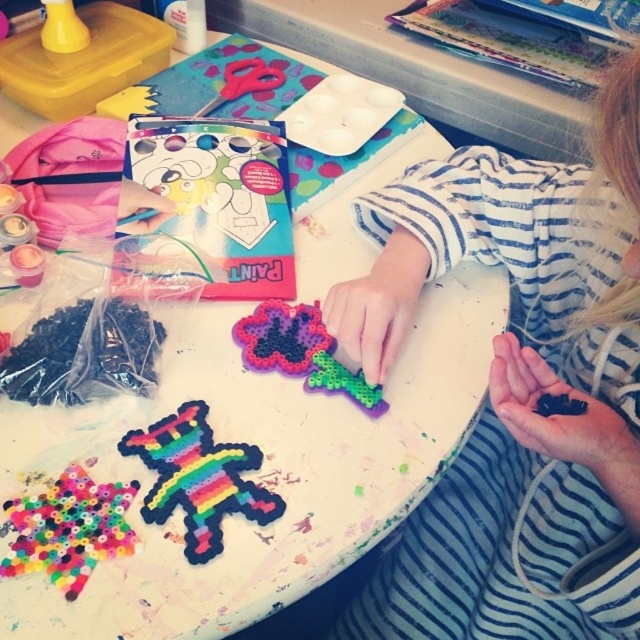
Is striped fabric shirt at center taller than rainbow plastic toy at lower left?

Correct, striped fabric shirt at center is much taller as rainbow plastic toy at lower left.

Which is above, striped fabric shirt at center or rainbow plastic toy at lower left?

striped fabric shirt at center

Which is in front, point (417, 516) or point (180, 435)?

Point (180, 435) is in front.

Identify the location of striped fabric shirt at center. The image size is (640, 640). (516, 390).

Which is in front, point (632, 465) or point (58, 586)?

Point (58, 586) is in front.

Who is shorter, striped fabric shirt at center or rainbow plastic beads at center?

With less height is rainbow plastic beads at center.

Locate an element on the screen. This screenshot has height=640, width=640. striped fabric shirt at center is located at coordinates (516, 390).

Where is `striped fabric shirt at center`? striped fabric shirt at center is located at coordinates (516, 390).

Can you confirm if striped fabric shirt at center is bigger than translucent plastic flower at center?

Indeed, striped fabric shirt at center has a larger size compared to translucent plastic flower at center.

Is striped fabric shirt at center closer to the viewer compared to translucent plastic flower at center?

That is True.

Between point (522, 284) and point (284, 339), which one is positioned in front?

Point (284, 339)

The width and height of the screenshot is (640, 640). I want to click on striped fabric shirt at center, so click(x=516, y=390).